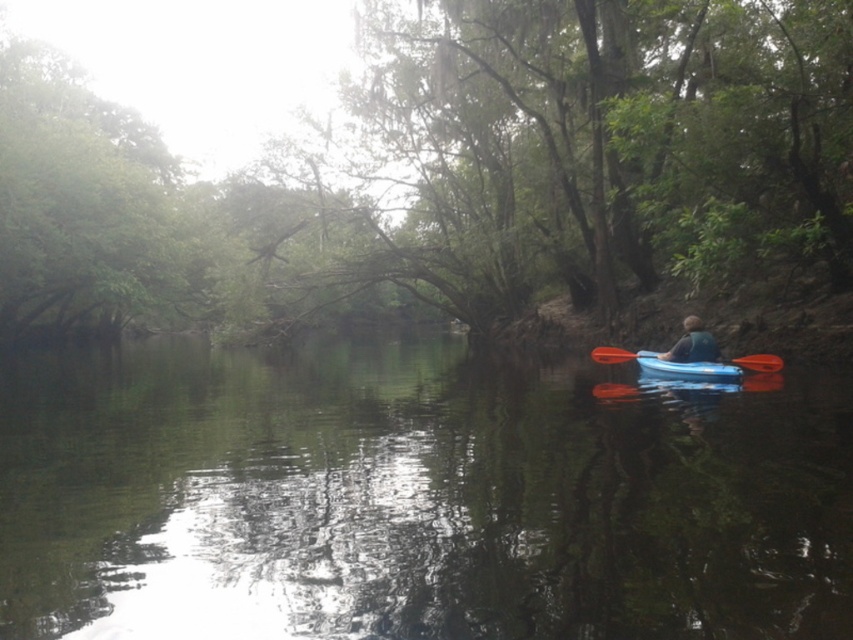
Question: Which of the following is the closest to the observer?

Choices:
 (A) green matte tree at center
 (B) blue plastic kayak at center
 (C) translucent blue kayak at center
 (D) orange plastic paddle at center

Answer: (A)

Question: Considering the relative positions of green matte tree at center and blue plastic kayak at center in the image provided, where is green matte tree at center located with respect to blue plastic kayak at center?

Choices:
 (A) below
 (B) above

Answer: (B)

Question: Which object is positioned closest to the orange plastic paddle at center?

Choices:
 (A) blue plastic kayak at center
 (B) blue plastic kayak at right

Answer: (A)

Question: From the image, what is the correct spatial relationship of translucent blue kayak at center in relation to orange plastic paddle at center?

Choices:
 (A) below
 (B) above

Answer: (A)

Question: Among these objects, which one is farthest from the camera?

Choices:
 (A) blue plastic kayak at right
 (B) green matte tree at center
 (C) translucent blue kayak at center
 (D) orange plastic paddle at center

Answer: (D)

Question: Is blue plastic kayak at right closer to the viewer compared to blue plastic kayak at center?

Choices:
 (A) no
 (B) yes

Answer: (B)